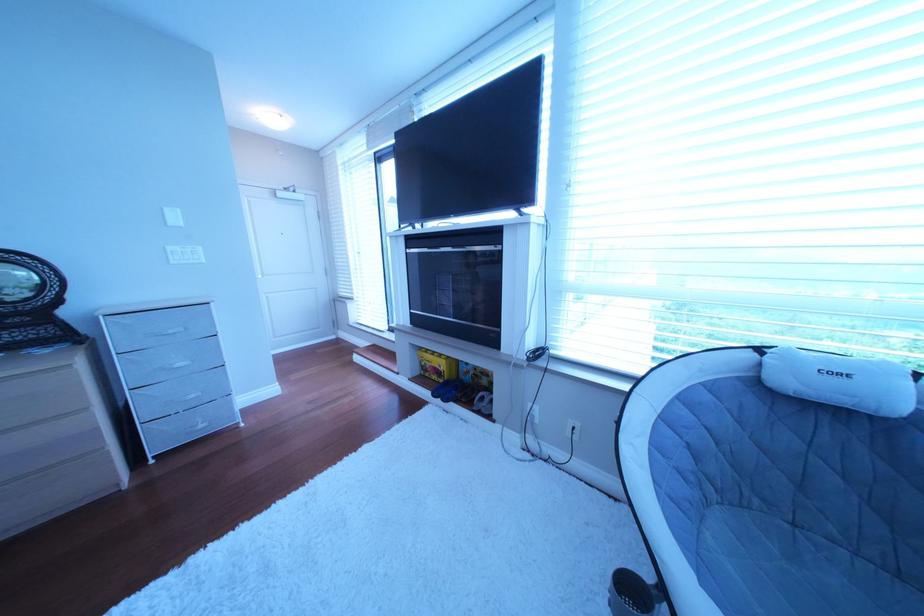
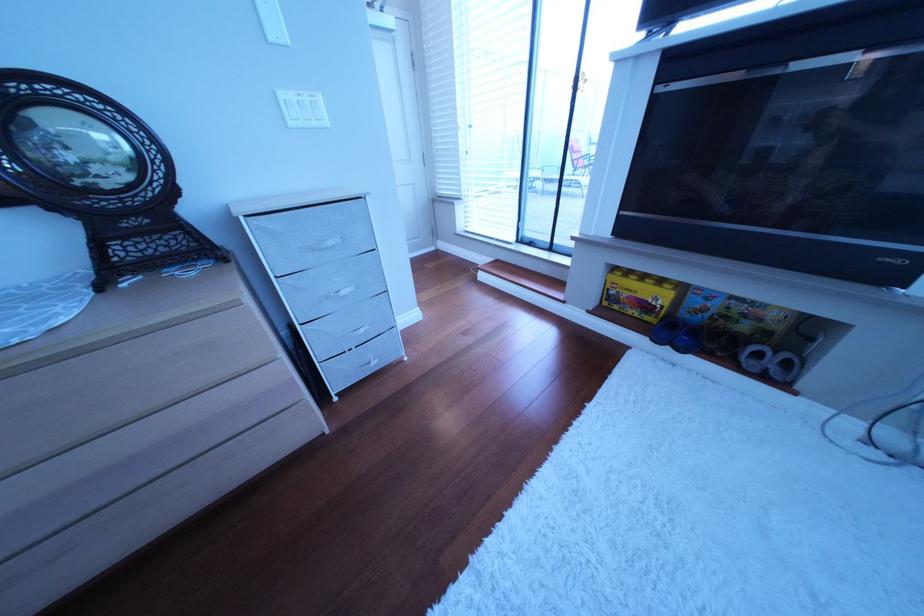
The point at (444, 367) is marked in the first image. Where is the corresponding point in the second image?

(640, 296)